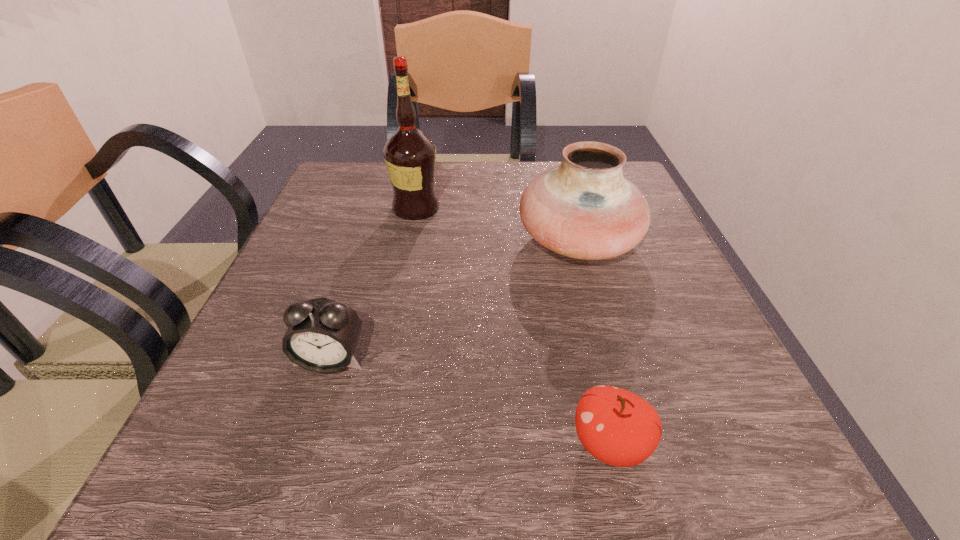
Find the location of `unoccupied area between the third farthest object and the apple`. unoccupied area between the third farthest object and the apple is located at coordinates click(469, 402).

This screenshot has width=960, height=540. What are the coordinates of `free spot between the second tallest object and the third farthest object` in the screenshot? It's located at [x=454, y=300].

Where is `free space between the second nearest object and the apple`? The height and width of the screenshot is (540, 960). free space between the second nearest object and the apple is located at coordinates (469, 402).

The height and width of the screenshot is (540, 960). I want to click on object that is the second nearest to the nearest object, so click(x=322, y=334).

Select which object appears as the second closest to the second tallest object. Please provide its 2D coordinates. Your answer should be formatted as a tuple, i.e. [(x, y)], where the tuple contains the x and y coordinates of a point satisfying the conditions above.

[(616, 426)]

The image size is (960, 540). In order to click on free spot that satisfies the following two spatial constraints: 1. on the back side of the second tallest object; 2. on the label of the alcohol in this screenshot , I will do `click(569, 208)`.

Image resolution: width=960 pixels, height=540 pixels. Find the location of `vacant space that satisfies the following two spatial constraints: 1. on the back side of the nearest object; 2. on the right side of the second tallest object`. vacant space that satisfies the following two spatial constraints: 1. on the back side of the nearest object; 2. on the right side of the second tallest object is located at coordinates (562, 241).

The image size is (960, 540). In order to click on blank area in the image that satisfies the following two spatial constraints: 1. on the back side of the apple; 2. on the label of the alcohol in this screenshot , I will do `click(554, 208)`.

This screenshot has width=960, height=540. What are the coordinates of `free space that satisfies the following two spatial constraints: 1. on the back side of the third shortest object; 2. on the label of the alcohol` in the screenshot? It's located at (569, 208).

This screenshot has width=960, height=540. Identify the location of free space in the image that satisfies the following two spatial constraints: 1. on the front side of the third farthest object; 2. on the right side of the apple. (303, 444).